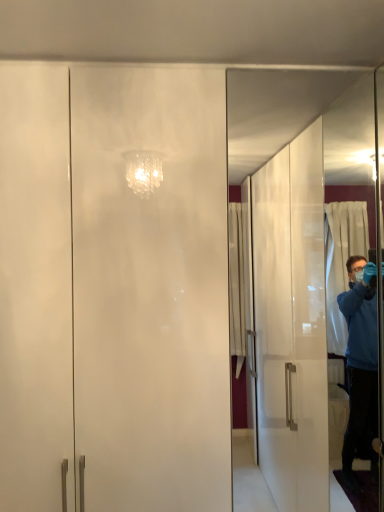
What are the coordinates of `transparent glass screen door at right, placed as the first screen door when sorted from right to left` in the screenshot? It's located at (306, 290).

What do you see at coordinates (306, 290) in the screenshot?
I see `transparent glass screen door at right, which is the second screen door from left to right` at bounding box center [306, 290].

Describe the element at coordinates (151, 290) in the screenshot. I see `frosted glass cabinet at center, the 1th screen door viewed from the left` at that location.

Measure the distance between point [206,109] and camera.

The depth of point [206,109] is 1.37 meters.

The height and width of the screenshot is (512, 384). I want to click on frosted glass cabinet at center, the 1th screen door viewed from the left, so click(x=151, y=290).

Locate an element on the screen. The width and height of the screenshot is (384, 512). transparent glass screen door at right, arranged as the second screen door when viewed from the front is located at coordinates (306, 290).

Would you say transparent glass screen door at right, which is the second screen door from left to right, is to the left or to the right of frosted glass cabinet at center, the first screen door positioned from the front, in the picture?

transparent glass screen door at right, which is the second screen door from left to right, is to the right of frosted glass cabinet at center, the first screen door positioned from the front.

Is transparent glass screen door at right, placed as the first screen door when sorted from right to left, in front of or behind frosted glass cabinet at center, the 1th screen door viewed from the left, in the image?

In the image, transparent glass screen door at right, placed as the first screen door when sorted from right to left, appears behind frosted glass cabinet at center, the 1th screen door viewed from the left.

Does point (323, 304) come in front of point (93, 403)?

No.

From the image's perspective, between transparent glass screen door at right, the first screen door in the back-to-front sequence, and frosted glass cabinet at center, the first screen door positioned from the front, who is located below?

frosted glass cabinet at center, the first screen door positioned from the front, appears lower in the image.

From a real-world perspective, is transparent glass screen door at right, the first screen door in the back-to-front sequence, positioned above or below frosted glass cabinet at center, the second screen door when ordered from back to front?

transparent glass screen door at right, the first screen door in the back-to-front sequence, is above frosted glass cabinet at center, the second screen door when ordered from back to front.

Can you confirm if transparent glass screen door at right, placed as the first screen door when sorted from right to left, is thinner than frosted glass cabinet at center, the 1th screen door viewed from the left?

Correct, the width of transparent glass screen door at right, placed as the first screen door when sorted from right to left, is less than that of frosted glass cabinet at center, the 1th screen door viewed from the left.

Can you confirm if transparent glass screen door at right, placed as the first screen door when sorted from right to left, is taller than frosted glass cabinet at center, the second screen door when ordered from back to front?

In fact, transparent glass screen door at right, placed as the first screen door when sorted from right to left, may be shorter than frosted glass cabinet at center, the second screen door when ordered from back to front.

Considering the relative sizes of transparent glass screen door at right, placed as the first screen door when sorted from right to left, and frosted glass cabinet at center, the 1th screen door viewed from the left, in the image provided, is transparent glass screen door at right, placed as the first screen door when sorted from right to left, bigger than frosted glass cabinet at center, the 1th screen door viewed from the left,?

Actually, transparent glass screen door at right, placed as the first screen door when sorted from right to left, might be smaller than frosted glass cabinet at center, the 1th screen door viewed from the left.

Do you think transparent glass screen door at right, arranged as the second screen door when viewed from the front, is within frosted glass cabinet at center, the first screen door positioned from the front, or outside of it?

transparent glass screen door at right, arranged as the second screen door when viewed from the front, cannot be found inside frosted glass cabinet at center, the first screen door positioned from the front.

Are transparent glass screen door at right, arranged as the second screen door when viewed from the front, and frosted glass cabinet at center, the second screen door when ordered from back to front, beside each other?

No, transparent glass screen door at right, arranged as the second screen door when viewed from the front, is not touching frosted glass cabinet at center, the second screen door when ordered from back to front.

Is transparent glass screen door at right, which is the second screen door from left to right, oriented away from frosted glass cabinet at center, the second screen door when ordered from back to front?

No.

This screenshot has width=384, height=512. In order to click on screen door in front of the transparent glass screen door at right, which is the second screen door from left to right in this screenshot , I will do [151, 290].

Does frosted glass cabinet at center, the second screen door when ordered from back to front, appear on the right side of transparent glass screen door at right, the first screen door in the back-to-front sequence?

No, frosted glass cabinet at center, the second screen door when ordered from back to front, is not to the right of transparent glass screen door at right, the first screen door in the back-to-front sequence.

Is frosted glass cabinet at center, the second screen door when ordered from back to front, positioned behind transparent glass screen door at right, which is the second screen door from left to right?

No, it is not.

Which point is more forward, (x=198, y=242) or (x=352, y=116)?

The point (x=198, y=242) is closer.

From the image's perspective, relative to transparent glass screen door at right, which is the second screen door from left to right, is frosted glass cabinet at center, which is the second screen door from right to left, above or below?

Clearly, from the image's perspective, frosted glass cabinet at center, which is the second screen door from right to left, is below transparent glass screen door at right, which is the second screen door from left to right.

From a real-world perspective, is frosted glass cabinet at center, the 1th screen door viewed from the left, under transparent glass screen door at right, which is the second screen door from left to right?

Yes.

Considering the sizes of objects frosted glass cabinet at center, the second screen door when ordered from back to front, and transparent glass screen door at right, placed as the first screen door when sorted from right to left, in the image provided, who is thinner, frosted glass cabinet at center, the second screen door when ordered from back to front, or transparent glass screen door at right, placed as the first screen door when sorted from right to left,?

transparent glass screen door at right, placed as the first screen door when sorted from right to left.

Between frosted glass cabinet at center, which is the second screen door from right to left, and transparent glass screen door at right, placed as the first screen door when sorted from right to left, which one has more height?

frosted glass cabinet at center, which is the second screen door from right to left.

Which of these two, frosted glass cabinet at center, the 1th screen door viewed from the left, or transparent glass screen door at right, placed as the first screen door when sorted from right to left, is smaller?

transparent glass screen door at right, placed as the first screen door when sorted from right to left, is smaller.

Is frosted glass cabinet at center, the 1th screen door viewed from the left, not within transparent glass screen door at right, which is the second screen door from left to right?

frosted glass cabinet at center, the 1th screen door viewed from the left, lies outside transparent glass screen door at right, which is the second screen door from left to right,'s area.

Would you consider frosted glass cabinet at center, the second screen door when ordered from back to front, to be distant from transparent glass screen door at right, arranged as the second screen door when viewed from the front?

Yes, frosted glass cabinet at center, the second screen door when ordered from back to front, is far from transparent glass screen door at right, arranged as the second screen door when viewed from the front.

Is frosted glass cabinet at center, which is the second screen door from right to left, aimed at transparent glass screen door at right, placed as the first screen door when sorted from right to left?

No, frosted glass cabinet at center, which is the second screen door from right to left, is not aimed at transparent glass screen door at right, placed as the first screen door when sorted from right to left.

How far apart are frosted glass cabinet at center, the second screen door when ordered from back to front, and transparent glass screen door at right, arranged as the second screen door when viewed from the front?

A distance of 3.33 feet exists between frosted glass cabinet at center, the second screen door when ordered from back to front, and transparent glass screen door at right, arranged as the second screen door when viewed from the front.

Identify the location of screen door lying in front of the transparent glass screen door at right, placed as the first screen door when sorted from right to left. (151, 290).

Identify the location of screen door directly beneath the transparent glass screen door at right, which is the second screen door from left to right (from a real-world perspective). (151, 290).

You are a GUI agent. You are given a task and a screenshot of the screen. Output one action in this format:
    pyautogui.click(x=<x>, y=<y>)
    Task: Click on the screen door in front of the transparent glass screen door at right, which is the second screen door from left to right
    
    Given the screenshot: What is the action you would take?
    pyautogui.click(x=151, y=290)